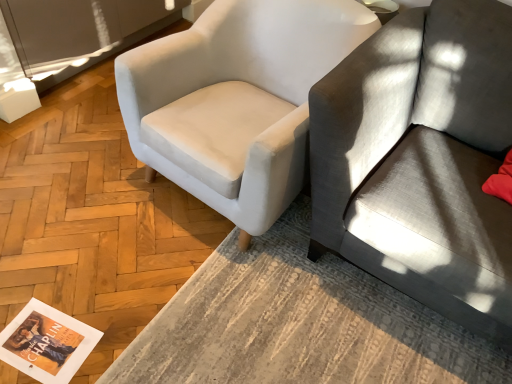
Image resolution: width=512 pixels, height=384 pixels. I want to click on textured gray rug at lower center, so click(x=298, y=324).

Measure the distance between point (472, 379) and camera.

Point (472, 379) and camera are 1.39 meters apart from each other.

Image resolution: width=512 pixels, height=384 pixels. I want to click on gray fabric couch at right, so click(x=421, y=160).

What is the approximate height of matte paper magazine at lower left?

It is 0.53 inches.

Locate an element on the screen. textured gray rug at lower center is located at coordinates (298, 324).

Consider the image. Which object is wider, textured gray rug at lower center or white fabric chair at upper left?

textured gray rug at lower center is wider.

Is textured gray rug at lower center inside the boundaries of white fabric chair at upper left, or outside?

textured gray rug at lower center exists outside the volume of white fabric chair at upper left.

From a real-world perspective, is textured gray rug at lower center positioned under white fabric chair at upper left based on gravity?

Yes, from a real-world perspective, textured gray rug at lower center is beneath white fabric chair at upper left.

I want to click on chair that appears behind the textured gray rug at lower center, so pyautogui.click(x=236, y=100).

Looking at this image, could you tell me if matte paper magazine at lower left is facing textured gray rug at lower center?

No.

From a real-world perspective, which is physically above, matte paper magazine at lower left or textured gray rug at lower center?

textured gray rug at lower center.

Which object is further away from the camera taking this photo, matte paper magazine at lower left or textured gray rug at lower center?

matte paper magazine at lower left is further from the camera.

From the image's perspective, would you say matte paper magazine at lower left is positioned over gray fabric couch at right?

No, from the image's perspective, matte paper magazine at lower left is not on top of gray fabric couch at right.

Identify the location of magazine below the gray fabric couch at right (from the image's perspective). (47, 343).

Based on the photo, which object is closer to the camera taking this photo, matte paper magazine at lower left or gray fabric couch at right?

gray fabric couch at right is closer to the camera.

Can you tell me how much matte paper magazine at lower left and gray fabric couch at right differ in facing direction?

matte paper magazine at lower left and gray fabric couch at right are facing 79.6 degrees away from each other.

Who is shorter, textured gray rug at lower center or matte paper magazine at lower left?

With less height is matte paper magazine at lower left.

From the image's perspective, is textured gray rug at lower center positioned above or below matte paper magazine at lower left?

textured gray rug at lower center is below matte paper magazine at lower left.

Considering the positions of objects textured gray rug at lower center and matte paper magazine at lower left in the image provided, who is more to the left, textured gray rug at lower center or matte paper magazine at lower left?

matte paper magazine at lower left.

You are a GUI agent. You are given a task and a screenshot of the screen. Output one action in this format:
    pyautogui.click(x=<x>, y=<y>)
    Task: Click on the chair that is behind the gray fabric couch at right
    
    Given the screenshot: What is the action you would take?
    pyautogui.click(x=236, y=100)

Can you tell me how much gray fabric couch at right and white fabric chair at upper left differ in facing direction?

The angle between the facing direction of gray fabric couch at right and the facing direction of white fabric chair at upper left is 4.47 degrees.

Which object is positioned more to the right, gray fabric couch at right or white fabric chair at upper left?

From the viewer's perspective, gray fabric couch at right appears more on the right side.

Looking at the image, does gray fabric couch at right seem bigger or smaller compared to white fabric chair at upper left?

gray fabric couch at right is bigger than white fabric chair at upper left.

Locate an element on the screen. The image size is (512, 384). table that appears below the gray fabric couch at right (from a real-world perspective) is located at coordinates (298, 324).

Which object is wider, gray fabric couch at right or textured gray rug at lower center?

textured gray rug at lower center is wider.

From a real-world perspective, who is located higher, gray fabric couch at right or textured gray rug at lower center?

gray fabric couch at right is physically above.

Does gray fabric couch at right have a greater height compared to textured gray rug at lower center?

Yes, gray fabric couch at right is taller than textured gray rug at lower center.

Where is `table that appears on the left of gray fabric couch at right`? The image size is (512, 384). table that appears on the left of gray fabric couch at right is located at coordinates (298, 324).

Which object is thinner, textured gray rug at lower center or gray fabric couch at right?

gray fabric couch at right is thinner.

Does textured gray rug at lower center contain gray fabric couch at right?

No, gray fabric couch at right is not a part of textured gray rug at lower center.

Image resolution: width=512 pixels, height=384 pixels. I want to click on chair that is on the left side of textured gray rug at lower center, so click(x=236, y=100).

In the image, there is a textured gray rug at lower center. Where is `magazine above it (from the image's perspective)`? This screenshot has height=384, width=512. magazine above it (from the image's perspective) is located at coordinates (47, 343).

Based on their spatial positions, is gray fabric couch at right or textured gray rug at lower center further from matte paper magazine at lower left?

gray fabric couch at right is further to matte paper magazine at lower left.

Looking at the image, which one is located further to textured gray rug at lower center, matte paper magazine at lower left or gray fabric couch at right?

Among the two, matte paper magazine at lower left is located further to textured gray rug at lower center.

Consider the image. Looking at the image, which one is located further to gray fabric couch at right, textured gray rug at lower center or matte paper magazine at lower left?

matte paper magazine at lower left is positioned further to the anchor gray fabric couch at right.

Considering their positions, is white fabric chair at upper left positioned further to gray fabric couch at right than textured gray rug at lower center?

Based on the image, textured gray rug at lower center appears to be further to gray fabric couch at right.

Estimate the real-world distances between objects in this image. Which object is closer to gray fabric couch at right, matte paper magazine at lower left or white fabric chair at upper left?

white fabric chair at upper left.

Considering their positions, is matte paper magazine at lower left positioned further to gray fabric couch at right than textured gray rug at lower center?

matte paper magazine at lower left lies further to gray fabric couch at right than the other object.

Considering their positions, is gray fabric couch at right positioned further to white fabric chair at upper left than matte paper magazine at lower left?

Among the two, matte paper magazine at lower left is located further to white fabric chair at upper left.

Estimate the real-world distances between objects in this image. Which object is further from white fabric chair at upper left, matte paper magazine at lower left or gray fabric couch at right?

matte paper magazine at lower left is positioned further to the anchor white fabric chair at upper left.

Find the location of a particular element. table between matte paper magazine at lower left and gray fabric couch at right in the horizontal direction is located at coordinates (298, 324).

This screenshot has width=512, height=384. I want to click on chair between matte paper magazine at lower left and gray fabric couch at right in the horizontal direction, so click(x=236, y=100).

Locate an element on the screen. magazine between white fabric chair at upper left and textured gray rug at lower center vertically is located at coordinates (47, 343).

This screenshot has width=512, height=384. In order to click on studio couch between white fabric chair at upper left and textured gray rug at lower center in the vertical direction in this screenshot , I will do `click(421, 160)`.